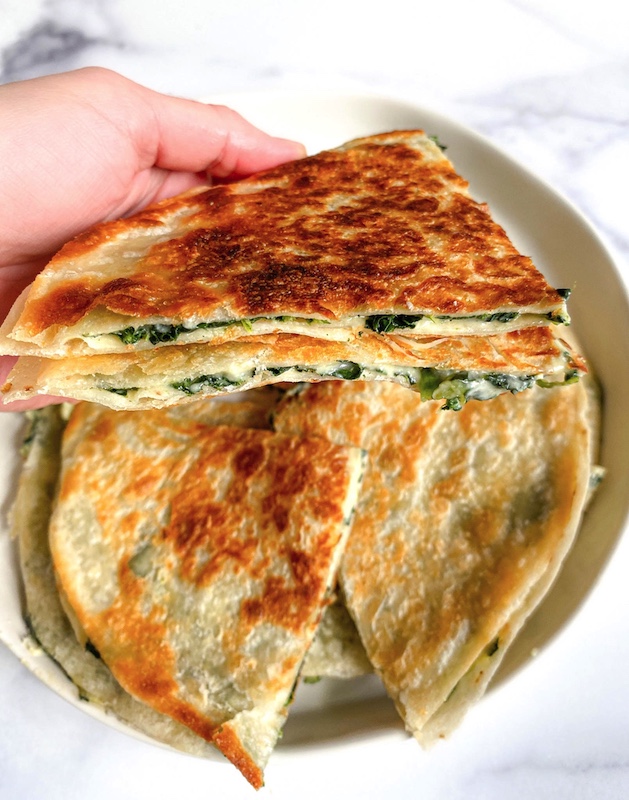
This screenshot has width=629, height=800. I want to click on plate, so click(564, 224).